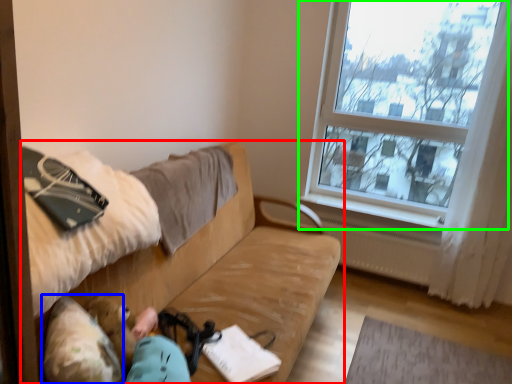
Question: Based on their relative distances, which object is farther from studio couch (highlighted by a red box)? Choose from animal (highlighted by a blue box) and window (highlighted by a green box).

Choices:
 (A) animal
 (B) window

Answer: (B)